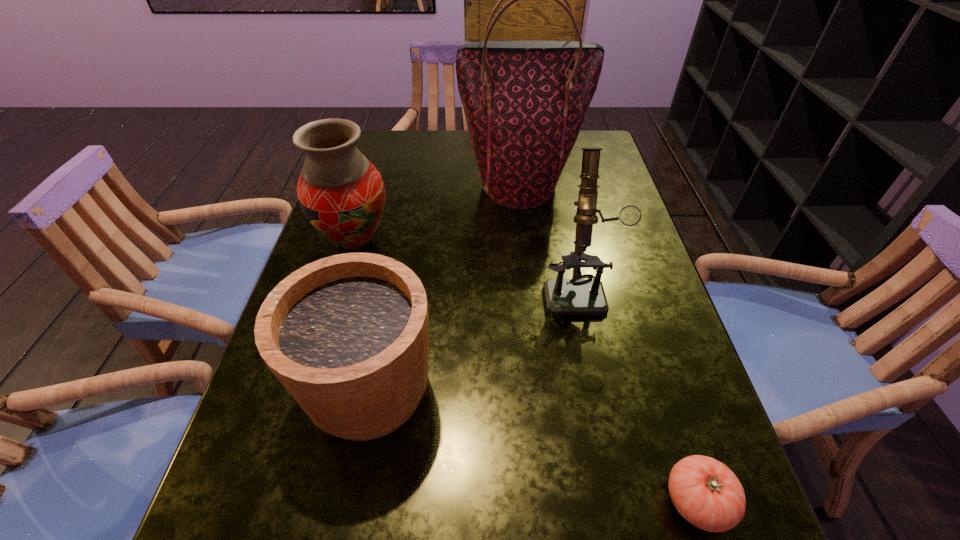
Image resolution: width=960 pixels, height=540 pixels. I want to click on vacant space in between the microscope and the vase, so click(x=467, y=265).

Identify the location of vacant space that's between the shortest object and the microscope. Image resolution: width=960 pixels, height=540 pixels. (637, 394).

The height and width of the screenshot is (540, 960). I want to click on vacant space that is in between the microscope and the flowerpot, so click(474, 338).

The height and width of the screenshot is (540, 960). Find the location of `empty space that is in between the fourth farthest object and the tallest object`. empty space that is in between the fourth farthest object and the tallest object is located at coordinates (444, 287).

I want to click on the fourth closest object relative to the vase, so click(x=705, y=492).

Point out which object is positioned as the fourth nearest to the nearest object. Please provide its 2D coordinates. Your answer should be formatted as a tuple, i.e. [(x, y)], where the tuple contains the x and y coordinates of a point satisfying the conditions above.

[(524, 101)]

At what (x,y) coordinates should I click in order to perform the action: click on free space that satisfies the following two spatial constraints: 1. at the eyepiece of the tomato; 2. on the left side of the microscope. Please return your answer as a coordinate pair (x, y). The width and height of the screenshot is (960, 540). Looking at the image, I should click on (623, 501).

At what (x,y) coordinates should I click in order to perform the action: click on free space that satisfies the following two spatial constraints: 1. on the back side of the farthest object; 2. on the left side of the vase. Please return your answer as a coordinate pair (x, y). Image resolution: width=960 pixels, height=540 pixels. Looking at the image, I should click on (372, 186).

Where is `vacant space that satisfies the following two spatial constraints: 1. on the back side of the flowerpot; 2. on the left side of the farthest object`? The height and width of the screenshot is (540, 960). vacant space that satisfies the following two spatial constraints: 1. on the back side of the flowerpot; 2. on the left side of the farthest object is located at coordinates (409, 186).